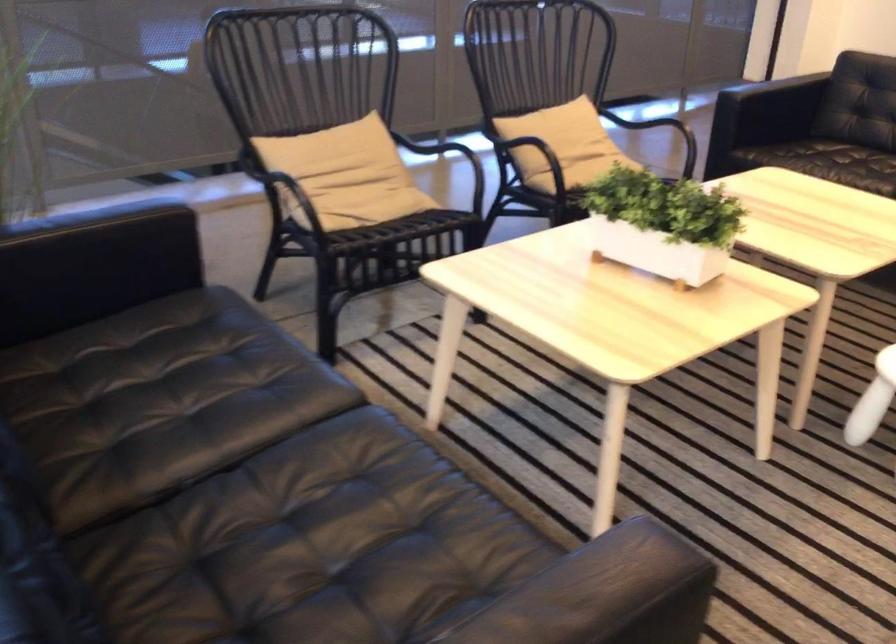
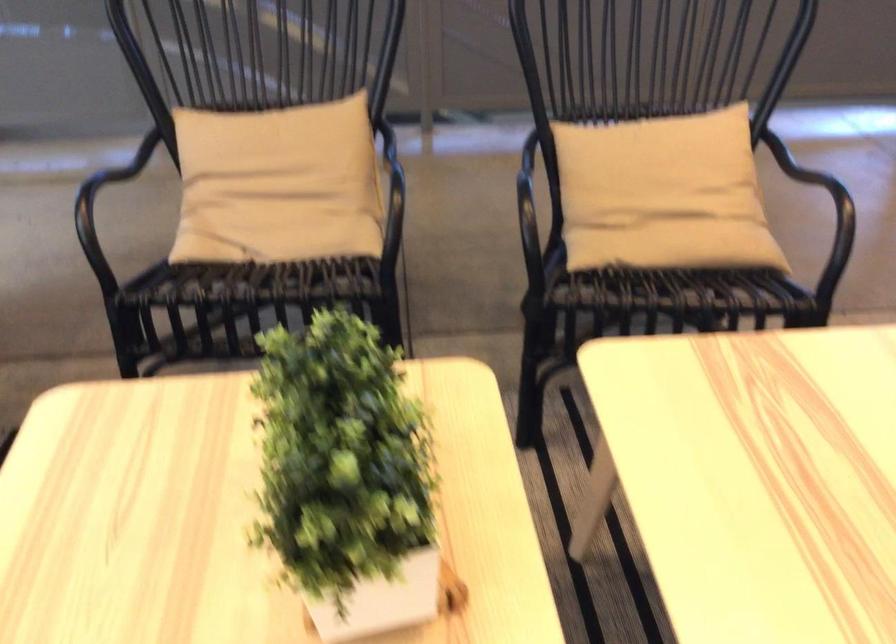
The point at (570,142) is marked in the first image. Where is the corresponding point in the second image?

(662, 194)